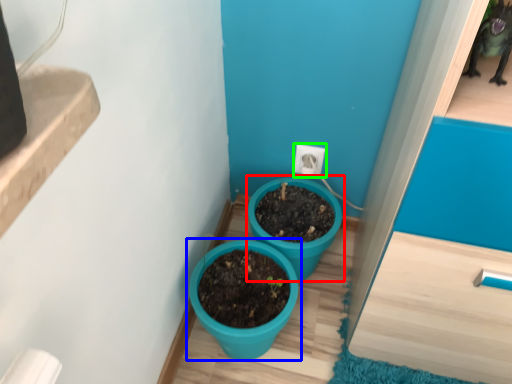
Question: Which is nearer to the flowerpot (highlighted by a red box)? flowerpot (highlighted by a blue box) or electric outlet (highlighted by a green box).

Choices:
 (A) flowerpot
 (B) electric outlet

Answer: (A)